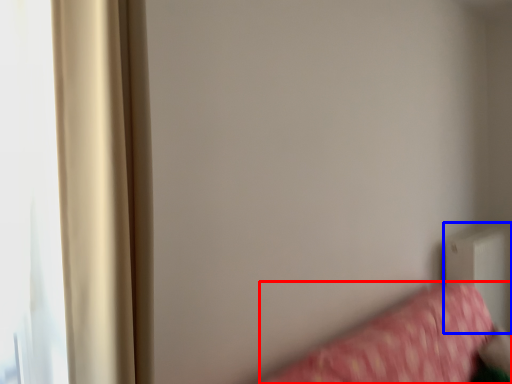
Question: Which point is closer to the camera, furniture (highlighted by a red box) or radiator (highlighted by a blue box)?

Choices:
 (A) furniture
 (B) radiator

Answer: (A)